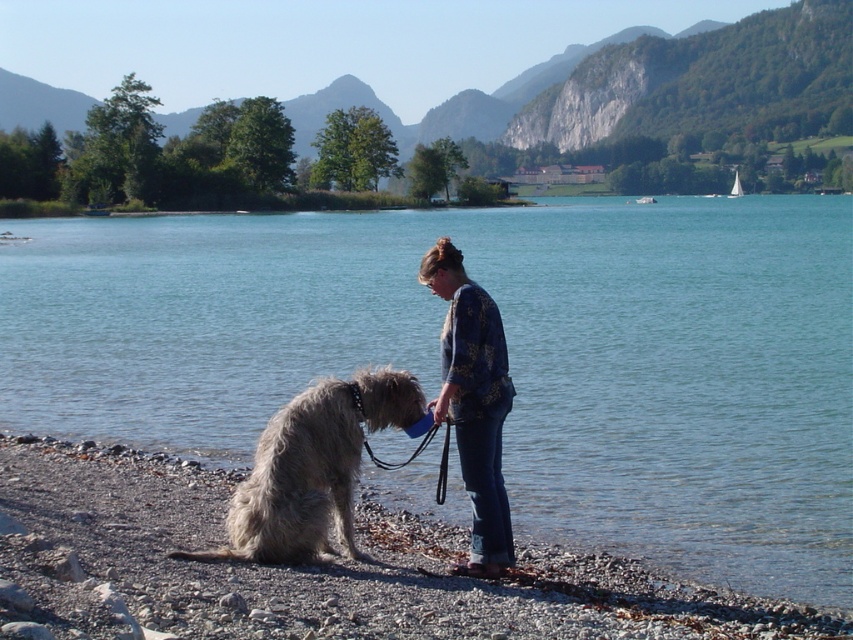
Question: Does clear blue water at center appear under floral-patterned fabric at center?

Choices:
 (A) no
 (B) yes

Answer: (A)

Question: Which of the following is the closest to the observer?

Choices:
 (A) clear blue water at center
 (B) gray shaggy fur at lower left

Answer: (B)

Question: From the image, what is the correct spatial relationship of clear blue water at center in relation to gray shaggy fur at lower left?

Choices:
 (A) right
 (B) left

Answer: (A)

Question: Is gray shaggy fur at lower left wider than floral-patterned fabric at center?

Choices:
 (A) yes
 (B) no

Answer: (A)

Question: Which object is farther from the camera taking this photo?

Choices:
 (A) smooth pebbles shoreline at lower left
 (B) floral-patterned fabric at center

Answer: (B)

Question: Among these objects, which one is nearest to the camera?

Choices:
 (A) gray shaggy fur at lower left
 (B) clear blue water at center
 (C) smooth pebbles shoreline at lower left

Answer: (C)